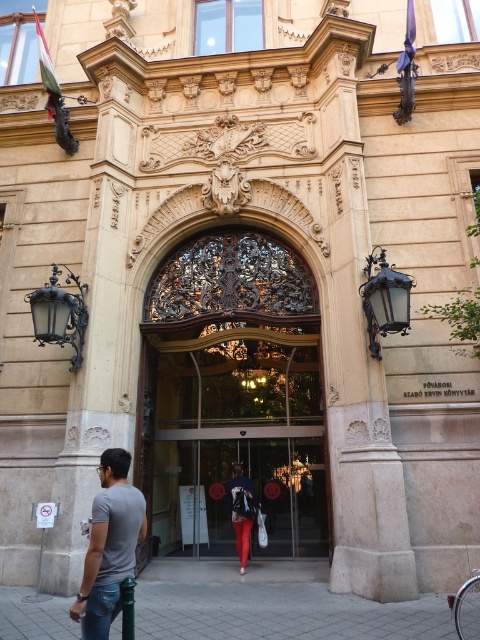
You are a delivery person with a large package that requires a 6 meter wide path to maneuver. You are at the entrance of the grand building and need to pass through the area between the dark brown wrought iron door at center and the beige stone pillar at center. Can you fit through this space with your package?

The dark brown wrought iron door at center and beige stone pillar at center are 5.73 meters apart. Since the required path is 6 meters wide, the space is narrower than needed, so you cannot fit through with the package.